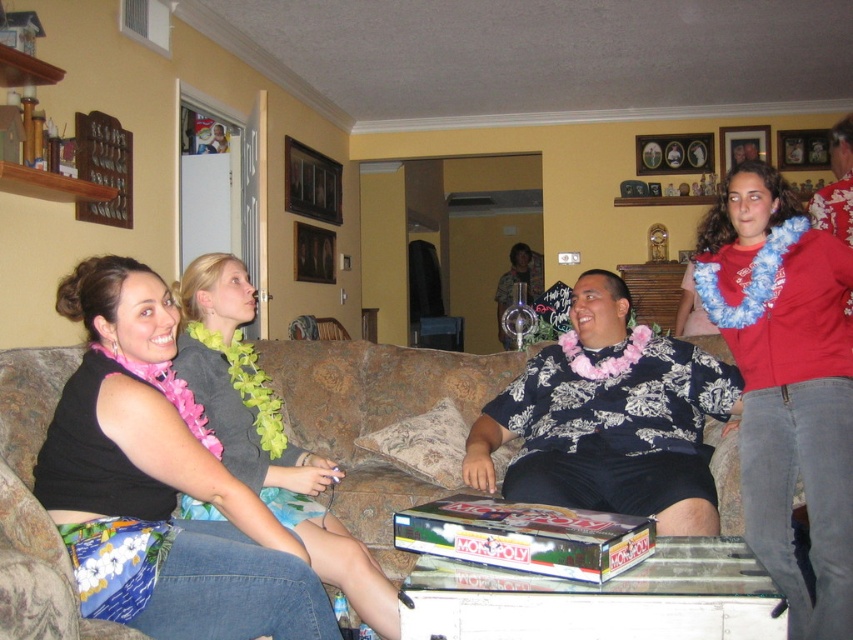
You are a guest at the party and want to wear both the red fabric lei at right and the pink floral shirt at center. Which item should you put on first according to their sizes?

The red fabric lei at right has a smaller size compared to the pink floral shirt at center, so you should put on the pink floral shirt at center first before wearing the red fabric lei at right.

In the scene shown: You are standing at the entrance of the living room and want to find the pink floral shirt at center. According to the coordinates provided, in which direction should you look to locate it?

The pink floral shirt at center is located at coordinates point (608, 419), which would be to the lower right direction from your position at the entrance.

You are a guest at the party and want to place a small decorative item on the brown fabric couch at center and the pink fabric lei at center. Which object allows you to place the item higher up?

The pink fabric lei at center allows placing the item higher up since it has a greater height than the brown fabric couch at center.